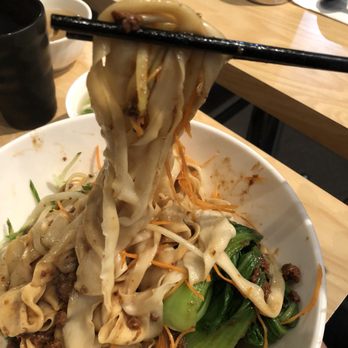
This screenshot has width=348, height=348. What are the coordinates of `bowls` in the screenshot? It's located at (62, 55), (77, 91), (75, 140).